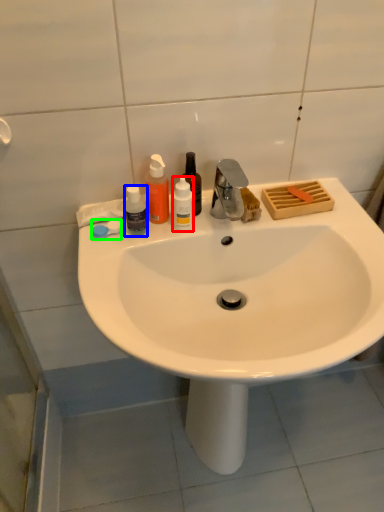
Question: Estimate the real-world distances between objects in this image. Which object is farther from bottle (highlighted by a red box), bottle (highlighted by a blue box) or soap (highlighted by a green box)?

Choices:
 (A) bottle
 (B) soap

Answer: (B)